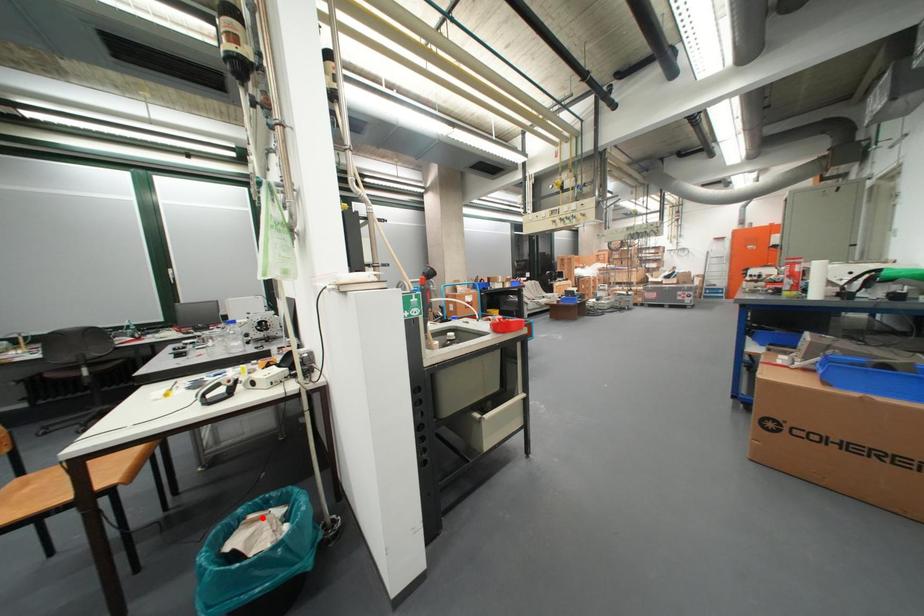
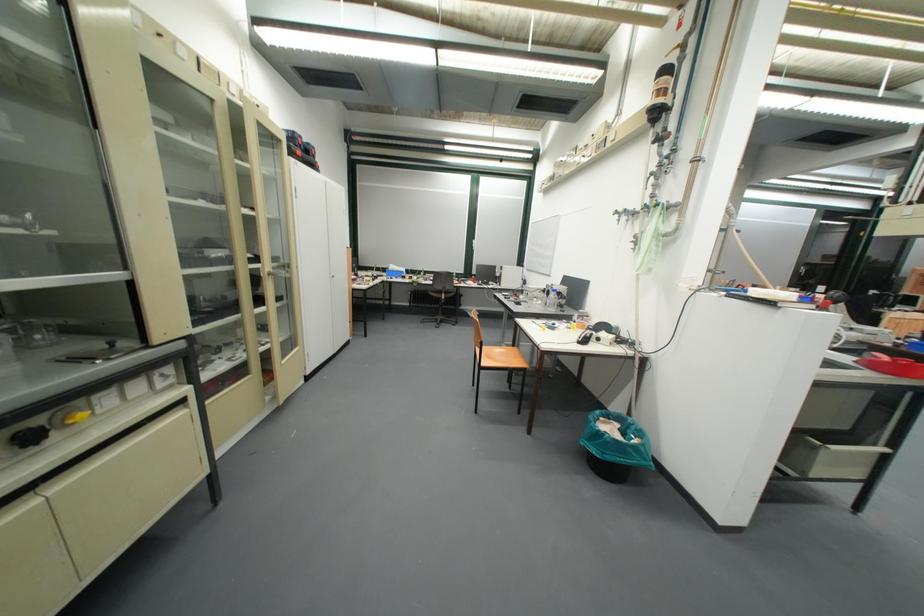
Find the pixel in the second image that matches the highlighted location in the first image.

(614, 419)